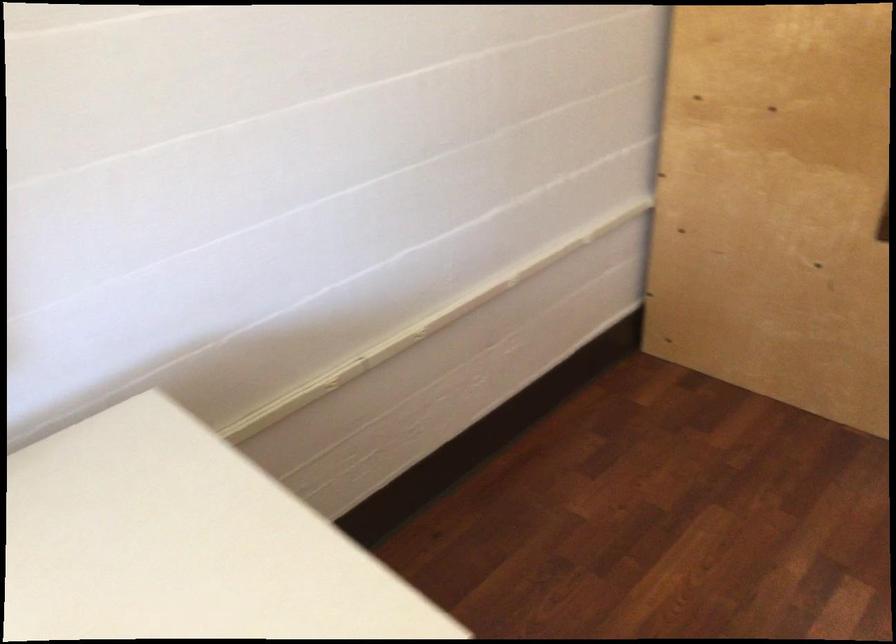
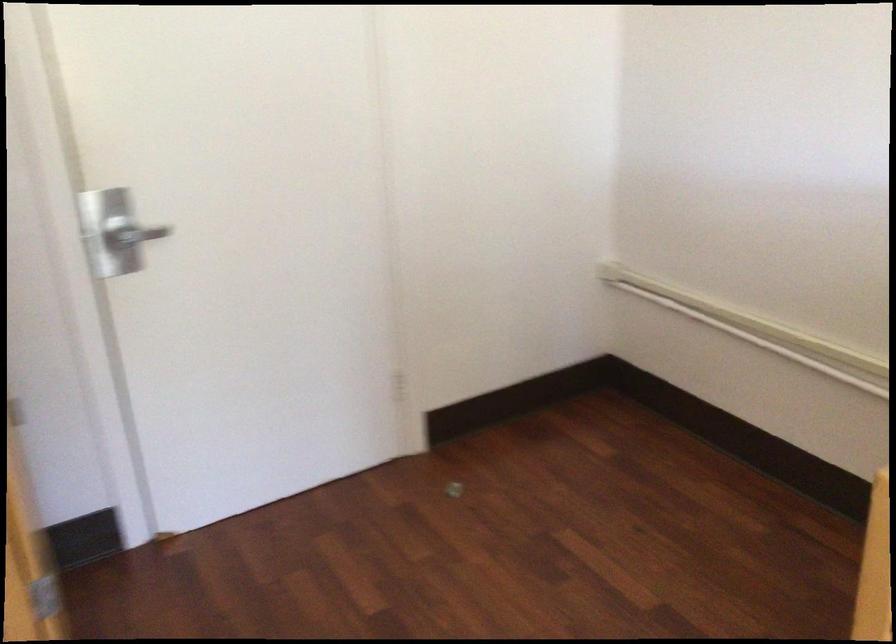
Question: How did the camera likely rotate?

Choices:
 (A) Left
 (B) Right
 (C) Up
 (D) Down

Answer: (B)